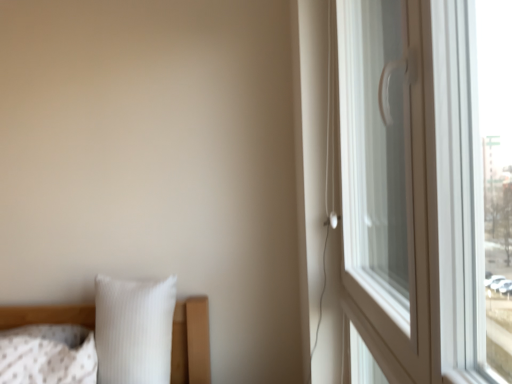
How much space does white ribbed pillow at lower left, which appears as the second pillow when viewed from the left, occupy horizontally?

The width of white ribbed pillow at lower left, which appears as the second pillow when viewed from the left, is 22.30 centimeters.

The height and width of the screenshot is (384, 512). I want to click on white ribbed pillow at lower left, which appears as the second pillow when viewed from the left, so click(x=134, y=330).

From the image's perspective, does white textured pillow at lower left, marked as the 1th pillow in a left-to-right arrangement, appear higher than white ribbed pillow at lower left, which is counted as the first pillow, starting from the right?

No, from the image's perspective, white textured pillow at lower left, marked as the 1th pillow in a left-to-right arrangement, is not above white ribbed pillow at lower left, which is counted as the first pillow, starting from the right.

Is white textured pillow at lower left, the 2th pillow in the right-to-left sequence, smaller than white ribbed pillow at lower left, which appears as the second pillow when viewed from the left?

Yes, white textured pillow at lower left, the 2th pillow in the right-to-left sequence, is smaller than white ribbed pillow at lower left, which appears as the second pillow when viewed from the left.

Does white textured pillow at lower left, marked as the 1th pillow in a left-to-right arrangement, have a greater height compared to white ribbed pillow at lower left, which is counted as the first pillow, starting from the right?

No.

From the image's perspective, is white textured pillow at lower left, the 2th pillow in the right-to-left sequence, under white glossy window handle at right?

Indeed, from the image's perspective, white textured pillow at lower left, the 2th pillow in the right-to-left sequence, is shown beneath white glossy window handle at right.

Who is taller, white textured pillow at lower left, the 2th pillow in the right-to-left sequence, or white glossy window handle at right?

white glossy window handle at right is taller.

Between point (49, 367) and point (391, 316), which one is positioned in front?

Positioned in front is point (391, 316).

Is white textured pillow at lower left, marked as the 1th pillow in a left-to-right arrangement, aimed at white glossy window handle at right?

No, white textured pillow at lower left, marked as the 1th pillow in a left-to-right arrangement, is not facing towards white glossy window handle at right.

Starting from the white glossy window handle at right, which pillow is the 1st one behind? Please provide its 2D coordinates.

[(134, 330)]

Considering the relative sizes of white glossy window handle at right and white ribbed pillow at lower left, which is counted as the first pillow, starting from the right, in the image provided, is white glossy window handle at right smaller than white ribbed pillow at lower left, which is counted as the first pillow, starting from the right,?

Incorrect, white glossy window handle at right is not smaller in size than white ribbed pillow at lower left, which is counted as the first pillow, starting from the right.

Based on their positions, is white glossy window handle at right located to the left or right of white ribbed pillow at lower left, which appears as the second pillow when viewed from the left?

In the image, white glossy window handle at right appears on the right side of white ribbed pillow at lower left, which appears as the second pillow when viewed from the left.

Is white glossy window handle at right taller than white ribbed pillow at lower left, which is counted as the first pillow, starting from the right?

Yes, white glossy window handle at right is taller than white ribbed pillow at lower left, which is counted as the first pillow, starting from the right.

Is white glossy window handle at right in front of or behind white textured pillow at lower left, marked as the 1th pillow in a left-to-right arrangement, in the image?

white glossy window handle at right is in front of white textured pillow at lower left, marked as the 1th pillow in a left-to-right arrangement.

Is white glossy window handle at right completely or partially outside of white textured pillow at lower left, the 2th pillow in the right-to-left sequence?

Absolutely, white glossy window handle at right is external to white textured pillow at lower left, the 2th pillow in the right-to-left sequence.

From the image's perspective, is white glossy window handle at right located above or below white textured pillow at lower left, the 2th pillow in the right-to-left sequence?

From the image's perspective, white glossy window handle at right appears above white textured pillow at lower left, the 2th pillow in the right-to-left sequence.

Which of these two, white glossy window handle at right or white textured pillow at lower left, marked as the 1th pillow in a left-to-right arrangement, is smaller?

white textured pillow at lower left, marked as the 1th pillow in a left-to-right arrangement.

From the image's perspective, is white ribbed pillow at lower left, which is counted as the first pillow, starting from the right, above or below white textured pillow at lower left, marked as the 1th pillow in a left-to-right arrangement?

From the image's perspective, white ribbed pillow at lower left, which is counted as the first pillow, starting from the right, appears above white textured pillow at lower left, marked as the 1th pillow in a left-to-right arrangement.

Between white ribbed pillow at lower left, which is counted as the first pillow, starting from the right, and white textured pillow at lower left, the 2th pillow in the right-to-left sequence, which one has smaller width?

Thinner between the two is white textured pillow at lower left, the 2th pillow in the right-to-left sequence.

From the picture: Is white ribbed pillow at lower left, which appears as the second pillow when viewed from the left, facing away from white textured pillow at lower left, marked as the 1th pillow in a left-to-right arrangement?

white ribbed pillow at lower left, which appears as the second pillow when viewed from the left, is not turned away from white textured pillow at lower left, marked as the 1th pillow in a left-to-right arrangement.

Is white ribbed pillow at lower left, which is counted as the first pillow, starting from the right, positioned beyond the bounds of white textured pillow at lower left, marked as the 1th pillow in a left-to-right arrangement?

Yes, white ribbed pillow at lower left, which is counted as the first pillow, starting from the right, is outside of white textured pillow at lower left, marked as the 1th pillow in a left-to-right arrangement.

From the image's perspective, would you say white ribbed pillow at lower left, which appears as the second pillow when viewed from the left, is shown under white glossy window handle at right?

Correct, white ribbed pillow at lower left, which appears as the second pillow when viewed from the left, appears lower than white glossy window handle at right in the image.

In the scene shown: Is white ribbed pillow at lower left, which is counted as the first pillow, starting from the right, positioned with its back to white glossy window handle at right?

white ribbed pillow at lower left, which is counted as the first pillow, starting from the right, is not turned away from white glossy window handle at right.

Can you tell me how much white ribbed pillow at lower left, which appears as the second pillow when viewed from the left, and white glossy window handle at right differ in facing direction?

The facing directions of white ribbed pillow at lower left, which appears as the second pillow when viewed from the left, and white glossy window handle at right are 89.3 degrees apart.

You are a GUI agent. You are given a task and a screenshot of the screen. Output one action in this format:
    pyautogui.click(x=<x>, y=<y>)
    Task: Click on the window that appears in front of the white ribbed pillow at lower left, which appears as the second pillow when viewed from the left
    
    Given the screenshot: What is the action you would take?
    pyautogui.click(x=420, y=197)

Find the location of a particular element. Image resolution: width=512 pixels, height=384 pixels. pillow that appears below the white ribbed pillow at lower left, which appears as the second pillow when viewed from the left (from a real-world perspective) is located at coordinates (48, 355).

There is a white glossy window handle at right. Identify the location of the 2nd pillow below it (from the image's perspective). (48, 355).

Estimate the real-world distances between objects in this image. Which object is further from white ribbed pillow at lower left, which is counted as the first pillow, starting from the right, white glossy window handle at right or white textured pillow at lower left, marked as the 1th pillow in a left-to-right arrangement?

white glossy window handle at right is further to white ribbed pillow at lower left, which is counted as the first pillow, starting from the right.

From the picture: From the image, which object appears to be farther from white ribbed pillow at lower left, which is counted as the first pillow, starting from the right, white textured pillow at lower left, marked as the 1th pillow in a left-to-right arrangement, or white glossy window handle at right?

white glossy window handle at right is positioned further to the anchor white ribbed pillow at lower left, which is counted as the first pillow, starting from the right.

Which object lies nearer to the anchor point white textured pillow at lower left, the 2th pillow in the right-to-left sequence, white ribbed pillow at lower left, which appears as the second pillow when viewed from the left, or white glossy window handle at right?

white ribbed pillow at lower left, which appears as the second pillow when viewed from the left.

Looking at this image, based on their spatial positions, is white ribbed pillow at lower left, which is counted as the first pillow, starting from the right, or white textured pillow at lower left, the 2th pillow in the right-to-left sequence, further from white glossy window handle at right?

Based on the image, white textured pillow at lower left, the 2th pillow in the right-to-left sequence, appears to be further to white glossy window handle at right.

Considering their positions, is white textured pillow at lower left, the 2th pillow in the right-to-left sequence, positioned further to white glossy window handle at right than white ribbed pillow at lower left, which is counted as the first pillow, starting from the right?

white textured pillow at lower left, the 2th pillow in the right-to-left sequence, lies further to white glossy window handle at right than the other object.

Which object lies further to the anchor point white textured pillow at lower left, marked as the 1th pillow in a left-to-right arrangement, white glossy window handle at right or white ribbed pillow at lower left, which is counted as the first pillow, starting from the right?

Based on the image, white glossy window handle at right appears to be further to white textured pillow at lower left, marked as the 1th pillow in a left-to-right arrangement.

At what (x,y) coordinates should I click in order to perform the action: click on pillow between white glossy window handle at right and white textured pillow at lower left, marked as the 1th pillow in a left-to-right arrangement, in the front-back direction. Please return your answer as a coordinate pair (x, y). Looking at the image, I should click on (134, 330).